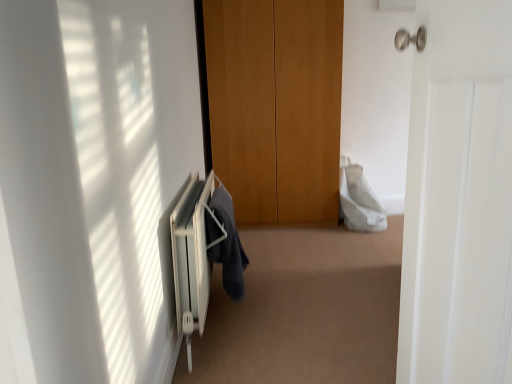
Question: Relative to white matte door at right, is dark gray fabric at lower center in front or behind?

Choices:
 (A) behind
 (B) front

Answer: (A)

Question: From a real-world perspective, relative to white matte door at right, is dark gray fabric at lower center vertically above or below?

Choices:
 (A) below
 (B) above

Answer: (A)

Question: Estimate the real-world distances between objects in this image. Which object is farther from the white matte door at right?

Choices:
 (A) dark gray fabric at lower center
 (B) white metallic radiator at lower left

Answer: (A)

Question: Which object is positioned closest to the white metallic radiator at lower left?

Choices:
 (A) white matte door at right
 (B) dark gray fabric at lower center

Answer: (B)